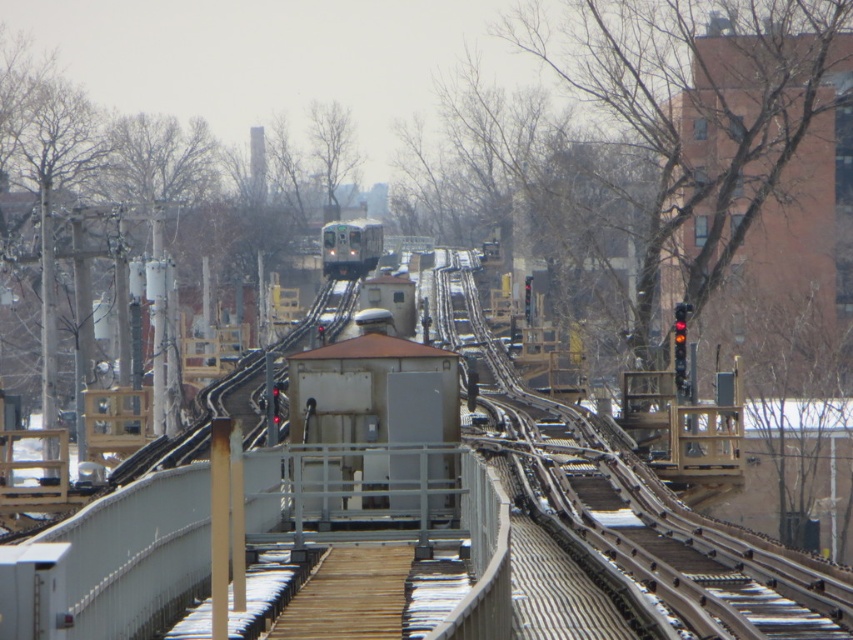
You are standing on the walkway and want to estimate how far the metal train track at center is from you. Based on the scene, can you determine the distance?

The metal train track at center is 46.78 feet away from the camera, so the distance from you to the metal train track at center is approximately 46.78 feet.